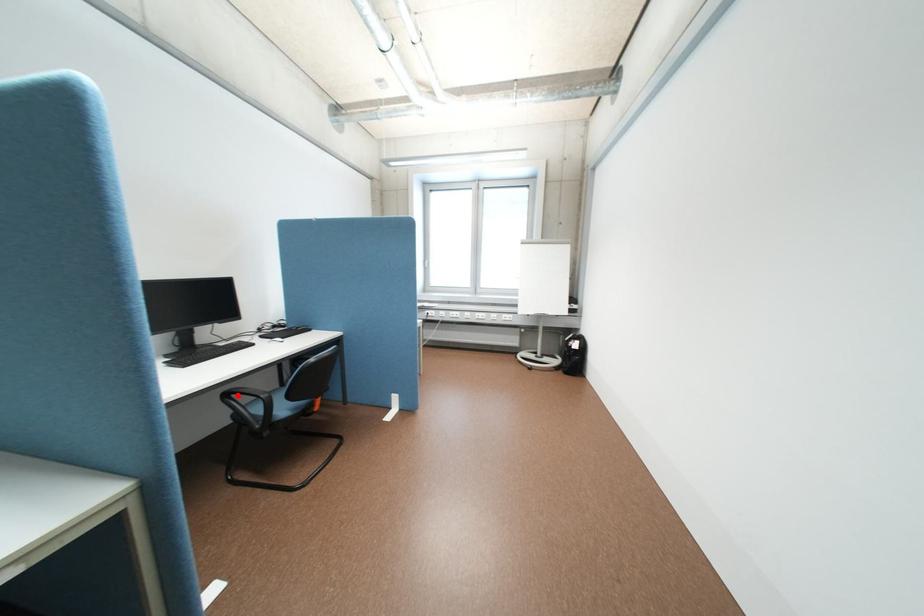
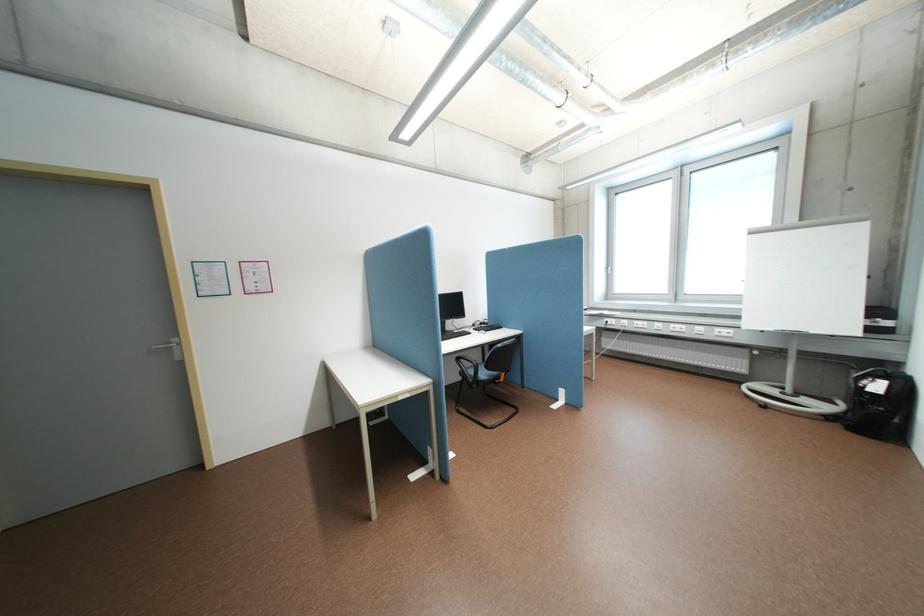
Question: I am providing you with two images of the same scene from different viewpoints. In image1, a red point is highlighted. Considering the same 3D point in image2, which of the following is correct?

Choices:
 (A) It is closer
 (B) It is farther

Answer: (B)